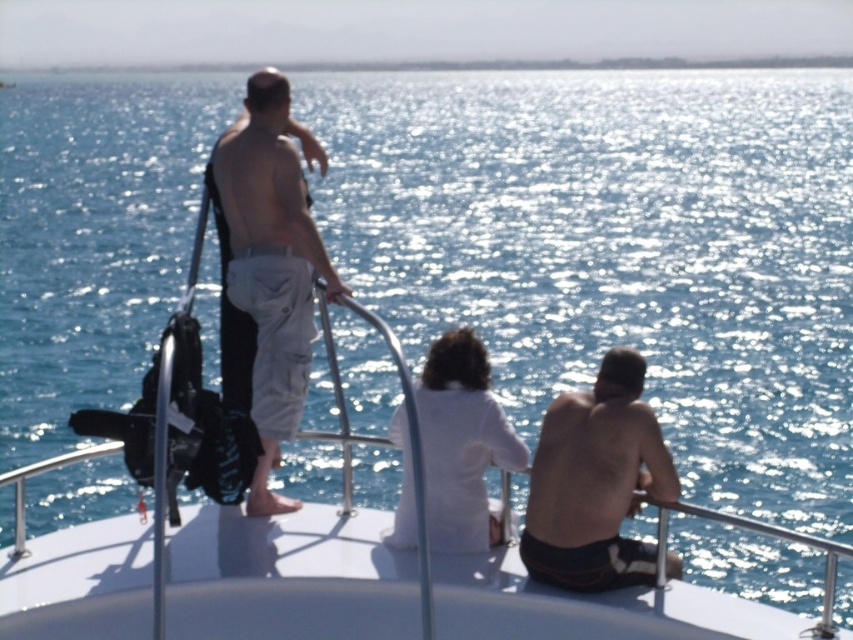
Which of these two, light gray cotton shorts at center or white cotton shirt at center, stands taller?

Standing taller between the two is light gray cotton shorts at center.

Between point (247, 138) and point (439, 404), which one is positioned in front?

Point (439, 404) is in front.

Locate an element on the screen. This screenshot has width=853, height=640. light gray cotton shorts at center is located at coordinates (271, 268).

Who is positioned more to the left, light gray cotton shorts at center or smooth skin torso at right?

From the viewer's perspective, light gray cotton shorts at center appears more on the left side.

Can you confirm if light gray cotton shorts at center is positioned below smooth skin torso at right?

Actually, light gray cotton shorts at center is above smooth skin torso at right.

Between point (305, 336) and point (576, 436), which one is positioned in front?

Point (576, 436)

At what (x,y) coordinates should I click in order to perform the action: click on light gray cotton shorts at center. Please return your answer as a coordinate pair (x, y). The height and width of the screenshot is (640, 853). Looking at the image, I should click on (271, 268).

Between smooth skin torso at right and white cotton shirt at center, which one appears on the right side from the viewer's perspective?

Positioned to the right is smooth skin torso at right.

Looking at this image, does smooth skin torso at right lie behind white cotton shirt at center?

No, it is not.

Describe the element at coordinates (595, 483) in the screenshot. I see `smooth skin torso at right` at that location.

This screenshot has width=853, height=640. Identify the location of smooth skin torso at right. (595, 483).